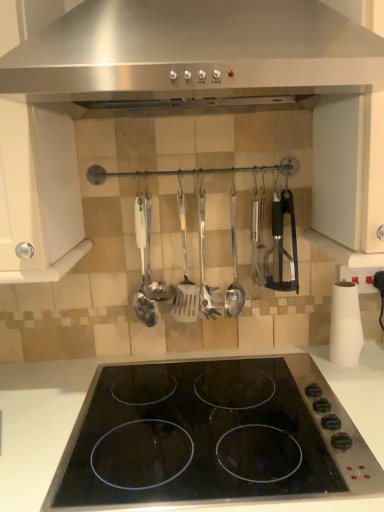
Question: Is black glass electric stove at center spatially inside satin silver spatula at center, which is the 2th spatula from left to right, or outside of it?

Choices:
 (A) outside
 (B) inside

Answer: (A)

Question: Visually, is black glass electric stove at center positioned to the left or to the right of satin silver spatula at center, which is the second spatula from right to left?

Choices:
 (A) right
 (B) left

Answer: (A)

Question: Based on their relative distances, which object is farther from the satin silver spatula at center, the 3th spatula from the right?

Choices:
 (A) satin silver spatula at center, which is the 1th spatula from right to left
 (B) white matte paper towel at right
 (C) black glass electric stove at center
 (D) stainless steel range hood at upper center
 (E) satin silver spoon at center

Answer: (B)

Question: Based on their relative distances, which object is nearer to the satin silver spatula at center, which is the 2th spatula from left to right?

Choices:
 (A) white matte paper towel at right
 (B) satin silver spatula at center, the third spatula in the left-to-right sequence
 (C) stainless steel range hood at upper center
 (D) satin silver spatula at center, which is counted as the 1th spatula, starting from the left
 (E) black glass electric stove at center

Answer: (D)